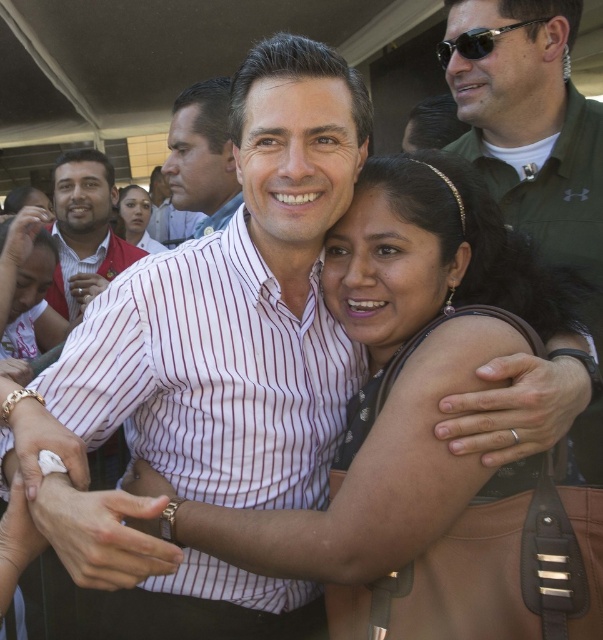
Who is shorter, matte red shirt at left or striped shirt at center?

With less height is striped shirt at center.

Is matte red shirt at left to the right of striped shirt at center from the viewer's perspective?

No, matte red shirt at left is not to the right of striped shirt at center.

Measure the distance between matte red shirt at left and camera.

matte red shirt at left and camera are 7.89 feet apart from each other.

Locate an element on the screen. This screenshot has height=640, width=603. matte red shirt at left is located at coordinates (84, 230).

Between point (212, 186) and point (484, 45), which one is positioned in front?

Point (484, 45) is more forward.

Locate an element on the screen. The width and height of the screenshot is (603, 640). striped shirt at center is located at coordinates (203, 156).

The height and width of the screenshot is (640, 603). Identify the location of striped shirt at center. (203, 156).

Who is more forward, (165, 186) or (458, 36)?

Positioned in front is point (458, 36).

Consider the image. Is matte white shirt at center below sunglasses at upper right?

Incorrect, matte white shirt at center is not positioned below sunglasses at upper right.

Who is more distant from viewer, (150, 234) or (545, 19)?

Positioned behind is point (150, 234).

This screenshot has height=640, width=603. Identify the location of matte white shirt at center. (168, 214).